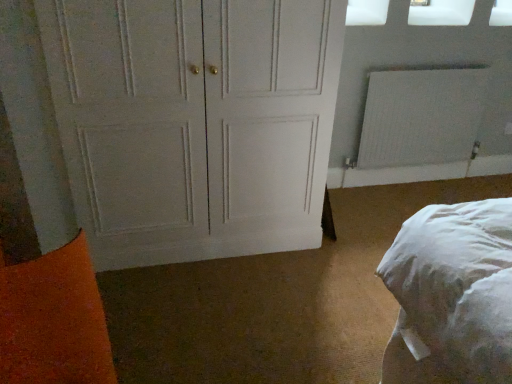
The height and width of the screenshot is (384, 512). In order to click on white textured radiator at upper right in this screenshot , I will do `click(421, 117)`.

Describe the element at coordinates (441, 12) in the screenshot. Image resolution: width=512 pixels, height=384 pixels. I see `transparent plastic window screen at upper right, the 1th window screen from the right` at that location.

Where is `white textured radiator at upper right`? white textured radiator at upper right is located at coordinates (421, 117).

Is there a large distance between transparent plastic window screen at upper right, the 1th window screen from the right, and white matte window screen at upper right, the first window screen from the left?

No, transparent plastic window screen at upper right, the 1th window screen from the right, is in close proximity to white matte window screen at upper right, the first window screen from the left.

Is transparent plastic window screen at upper right, positioned as the second window screen in left-to-right order, spatially inside white matte window screen at upper right, which appears as the second window screen when viewed from the right, or outside of it?

transparent plastic window screen at upper right, positioned as the second window screen in left-to-right order, lies outside white matte window screen at upper right, which appears as the second window screen when viewed from the right.

From the image's perspective, which one is positioned lower, transparent plastic window screen at upper right, the 1th window screen from the right, or white matte window screen at upper right, the first window screen from the left?

white matte window screen at upper right, the first window screen from the left.

From the image's perspective, would you say white painted wood door at center is shown under transparent plastic window screen at upper right, positioned as the second window screen in left-to-right order?

Yes, from the image's perspective, white painted wood door at center is below transparent plastic window screen at upper right, positioned as the second window screen in left-to-right order.

Considering the sizes of objects white painted wood door at center and transparent plastic window screen at upper right, the 1th window screen from the right, in the image provided, who is smaller, white painted wood door at center or transparent plastic window screen at upper right, the 1th window screen from the right,?

Smaller between the two is transparent plastic window screen at upper right, the 1th window screen from the right.

Does white painted wood door at center contain transparent plastic window screen at upper right, the 1th window screen from the right?

Actually, transparent plastic window screen at upper right, the 1th window screen from the right, is outside white painted wood door at center.

Is white painted wood door at center facing towards transparent plastic window screen at upper right, positioned as the second window screen in left-to-right order?

No, white painted wood door at center is not turned towards transparent plastic window screen at upper right, positioned as the second window screen in left-to-right order.

Considering the relative positions of white matte window screen at upper right, the first window screen from the left, and white painted wood door at center in the image provided, is white matte window screen at upper right, the first window screen from the left, behind white painted wood door at center?

That is True.

From the image's perspective, does white matte window screen at upper right, the first window screen from the left, appear lower than white painted wood door at center?

No, from the image's perspective, white matte window screen at upper right, the first window screen from the left, is not beneath white painted wood door at center.

Consider the image. Is white matte window screen at upper right, the first window screen from the left, positioned with its back to white painted wood door at center?

No, white matte window screen at upper right, the first window screen from the left, is not facing the opposite direction of white painted wood door at center.

From the image's perspective, who appears lower, white painted wood door at center or white textured radiator at upper right?

From the image's view, white painted wood door at center is below.

Does white painted wood door at center have a greater width compared to white textured radiator at upper right?

Indeed, white painted wood door at center has a greater width compared to white textured radiator at upper right.

From a real-world perspective, which object stands above the other?

From a 3D spatial view, white painted wood door at center is above.

Is white textured radiator at upper right turned away from white painted wood door at center?

No, white painted wood door at center is not at the back of white textured radiator at upper right.

Is white textured radiator at upper right thinner than white painted wood door at center?

Yes.

Based on the photo, measure the distance between white textured radiator at upper right and white painted wood door at center.

white textured radiator at upper right and white painted wood door at center are 1.12 meters apart from each other.

From the image's perspective, which one is positioned lower, white textured radiator at upper right or white painted wood door at center?

white painted wood door at center.

Is white textured radiator at upper right smaller than white matte window screen at upper right, the first window screen from the left?

No.

Is the position of white textured radiator at upper right less distant than that of white matte window screen at upper right, which appears as the second window screen when viewed from the right?

No, the depth of white textured radiator at upper right is greater than that of white matte window screen at upper right, which appears as the second window screen when viewed from the right.

Image resolution: width=512 pixels, height=384 pixels. There is a white textured radiator at upper right. What are the coordinates of `the 2nd window screen above it (from a real-world perspective)` in the screenshot? It's located at (366, 12).

Is white matte window screen at upper right, which appears as the second window screen when viewed from the right, located within white textured radiator at upper right?

Definitely not — white matte window screen at upper right, which appears as the second window screen when viewed from the right, is not inside white textured radiator at upper right.

Between white textured radiator at upper right and transparent plastic window screen at upper right, the 1th window screen from the right, which one has more height?

white textured radiator at upper right is taller.

Is white textured radiator at upper right aimed at transparent plastic window screen at upper right, positioned as the second window screen in left-to-right order?

No.

Considering the sizes of objects white textured radiator at upper right and transparent plastic window screen at upper right, the 1th window screen from the right, in the image provided, who is bigger, white textured radiator at upper right or transparent plastic window screen at upper right, the 1th window screen from the right,?

white textured radiator at upper right is bigger.

At what (x,y) coordinates should I click in order to perform the action: click on window screen to the left of transparent plastic window screen at upper right, positioned as the second window screen in left-to-right order. Please return your answer as a coordinate pair (x, y). Image resolution: width=512 pixels, height=384 pixels. Looking at the image, I should click on (366, 12).

Locate an element on the screen. door located underneath the transparent plastic window screen at upper right, positioned as the second window screen in left-to-right order (from a real-world perspective) is located at coordinates (194, 122).

From the image, which object appears to be farther from white painted wood door at center, white matte window screen at upper right, which appears as the second window screen when viewed from the right, or white textured radiator at upper right?

Among the two, white matte window screen at upper right, which appears as the second window screen when viewed from the right, is located further to white painted wood door at center.

Looking at the image, which one is located further to white matte window screen at upper right, the first window screen from the left, white painted wood door at center or transparent plastic window screen at upper right, positioned as the second window screen in left-to-right order?

white painted wood door at center lies further to white matte window screen at upper right, the first window screen from the left, than the other object.

When comparing their distances from transparent plastic window screen at upper right, the 1th window screen from the right, does white textured radiator at upper right or white painted wood door at center seem closer?

white textured radiator at upper right is closer to transparent plastic window screen at upper right, the 1th window screen from the right.

Looking at the image, which one is located closer to white textured radiator at upper right, transparent plastic window screen at upper right, positioned as the second window screen in left-to-right order, or white painted wood door at center?

transparent plastic window screen at upper right, positioned as the second window screen in left-to-right order, lies closer to white textured radiator at upper right than the other object.

Estimate the real-world distances between objects in this image. Which object is further from white matte window screen at upper right, which appears as the second window screen when viewed from the right, white painted wood door at center or white textured radiator at upper right?

white painted wood door at center is further to white matte window screen at upper right, which appears as the second window screen when viewed from the right.

Looking at this image, which object lies further to the anchor point white painted wood door at center, transparent plastic window screen at upper right, positioned as the second window screen in left-to-right order, or white textured radiator at upper right?

Based on the image, transparent plastic window screen at upper right, positioned as the second window screen in left-to-right order, appears to be further to white painted wood door at center.

Considering their positions, is transparent plastic window screen at upper right, positioned as the second window screen in left-to-right order, positioned closer to white painted wood door at center than white matte window screen at upper right, the first window screen from the left?

Among the two, white matte window screen at upper right, the first window screen from the left, is located nearer to white painted wood door at center.

Looking at the image, which one is located closer to white textured radiator at upper right, white painted wood door at center or transparent plastic window screen at upper right, positioned as the second window screen in left-to-right order?

transparent plastic window screen at upper right, positioned as the second window screen in left-to-right order, is positioned closer to the anchor white textured radiator at upper right.

In order to click on window screen between white painted wood door at center and transparent plastic window screen at upper right, the 1th window screen from the right, from left to right in this screenshot , I will do `click(366, 12)`.

You are a GUI agent. You are given a task and a screenshot of the screen. Output one action in this format:
    pyautogui.click(x=<x>, y=<y>)
    Task: Click on the window screen between transparent plastic window screen at upper right, positioned as the second window screen in left-to-right order, and white textured radiator at upper right, in the vertical direction
    This screenshot has height=384, width=512.
    Given the screenshot: What is the action you would take?
    pyautogui.click(x=366, y=12)